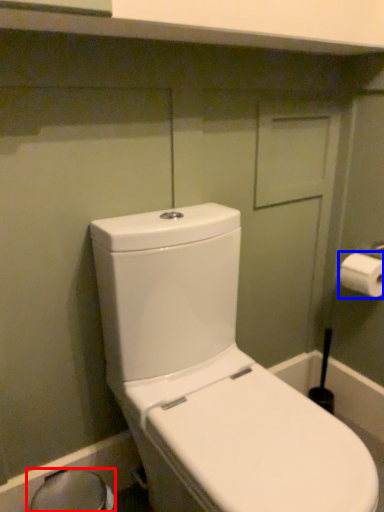
Question: Which object appears farthest to the camera in this image, bidet (highlighted by a red box) or toilet paper (highlighted by a blue box)?

Choices:
 (A) bidet
 (B) toilet paper

Answer: (B)